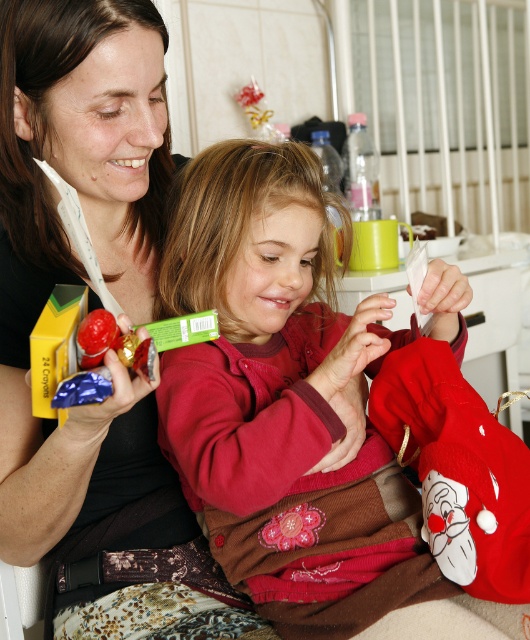
Does matte black shirt at center lie in front of shiny metallic chocolate at center?

That is False.

Between point (21, 230) and point (56, 298), which one is positioned in front?

Point (56, 298) is in front.

Who is more forward, [104,422] or [110,298]?

Point [110,298]

I want to click on matte black shirt at center, so click(x=83, y=269).

Identify the location of velvet red sweater at center. Image resolution: width=530 pixels, height=640 pixels. (279, 396).

Does point (173, 392) come in front of point (66, 353)?

No, (173, 392) is further to viewer.

Which is in front, point (260, 234) or point (58, 376)?

Point (58, 376)

At what (x,y) coordinates should I click in order to perform the action: click on velvet red sweater at center. Please return your answer as a coordinate pair (x, y). Image resolution: width=530 pixels, height=640 pixels. Looking at the image, I should click on (279, 396).

Measure the distance between point (262, 348) and camera.

36.14 inches

Which is in front, point (197, 484) or point (101, 412)?

Point (101, 412) is in front.

This screenshot has width=530, height=640. Identify the location of velvet red sweater at center. (279, 396).